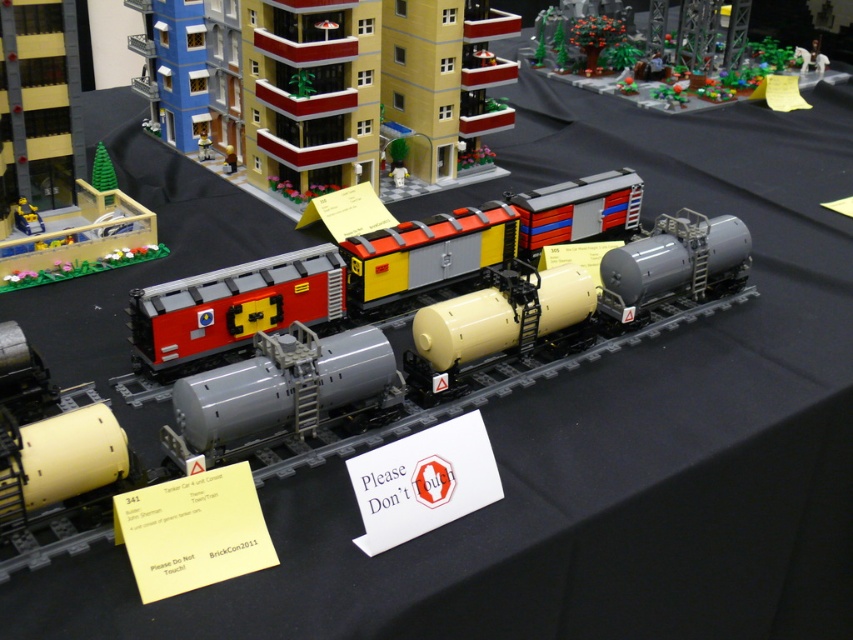
Which is above, matte black train car at center or matte gray train car at center?

matte gray train car at center is above.

Can you confirm if matte black train car at center is positioned below matte gray train car at center?

Correct, matte black train car at center is located below matte gray train car at center.

Does point (614, 200) come farther from viewer compared to point (236, 160)?

No, (614, 200) is in front of (236, 160).

This screenshot has width=853, height=640. I want to click on matte black train car at center, so point(368,273).

Based on the photo, can you confirm if smooth gray horse at upper center is positioned below matte gray train car at center?

Actually, smooth gray horse at upper center is above matte gray train car at center.

Is point (735, 4) more distant than point (228, 154)?

Yes.

Who is more forward, (677, 32) or (230, 154)?

Point (230, 154)

Image resolution: width=853 pixels, height=640 pixels. Find the location of `smooth gray horse at upper center`. smooth gray horse at upper center is located at coordinates (737, 22).

Is brushed metal train car at center below matte gray train car at center?

Yes.

Looking at this image, which is above, brushed metal train car at center or matte gray train car at center?

matte gray train car at center

From the picture: Who is more distant from viewer, (21, 209) or (231, 145)?

Point (231, 145)

Locate an element on the screen. brushed metal train car at center is located at coordinates (27, 218).